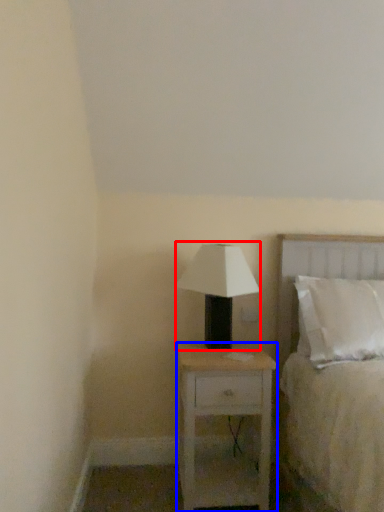
Question: Which object is further to the camera taking this photo, table lamp (highlighted by a red box) or nightstand (highlighted by a blue box)?

Choices:
 (A) table lamp
 (B) nightstand

Answer: (A)